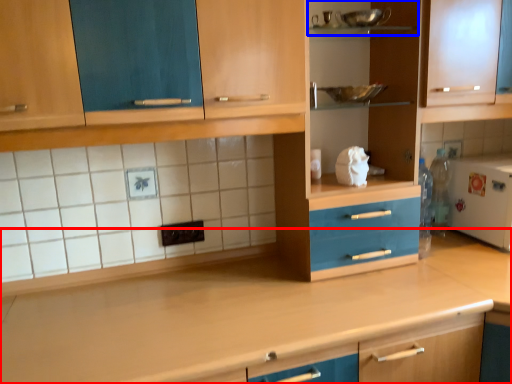
Question: Which object appears farthest to the camera in this image, countertop (highlighted by a red box) or shelf (highlighted by a blue box)?

Choices:
 (A) countertop
 (B) shelf

Answer: (B)